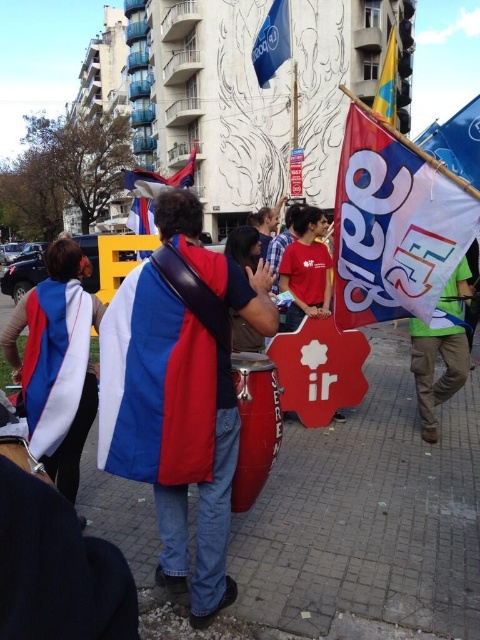
Between white fabric flag at upper right and blue and white fabric flag at center, which one is positioned lower?

white fabric flag at upper right

Between white fabric flag at upper right and blue and white fabric flag at center, which one has less height?

white fabric flag at upper right

In the scene shown: Measure the distance between white fabric flag at upper right and camera.

white fabric flag at upper right and camera are 3.59 meters apart.

Image resolution: width=480 pixels, height=640 pixels. Find the location of `white fabric flag at upper right`. white fabric flag at upper right is located at coordinates (395, 225).

Measure the distance between point [267,29] and camera.

They are 7.86 meters apart.

Who is taller, blue fabric flag at upper center or yellow fabric flag at upper right?

Standing taller between the two is yellow fabric flag at upper right.

This screenshot has height=640, width=480. What do you see at coordinates (272, 42) in the screenshot?
I see `blue fabric flag at upper center` at bounding box center [272, 42].

Where is `blue fabric flag at upper center`? The image size is (480, 640). blue fabric flag at upper center is located at coordinates (272, 42).

Is red and blue fabric at center further to camera compared to yellow fabric flag at upper right?

No, red and blue fabric at center is in front of yellow fabric flag at upper right.

Identify the location of red and blue fabric at center. (180, 392).

Locate an element on the screen. This screenshot has height=640, width=480. red and blue fabric at center is located at coordinates (180, 392).

Locate an element on the screen. The width and height of the screenshot is (480, 640). red and blue fabric at center is located at coordinates (180, 392).